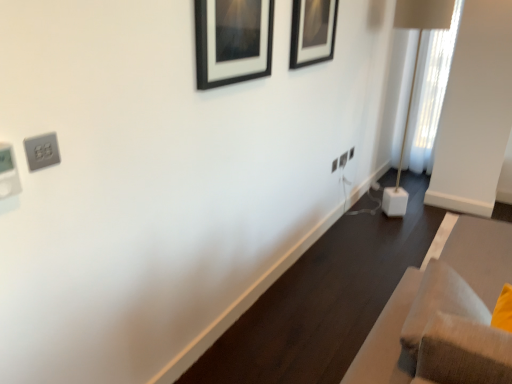
Question: Considering the positions of white cube base at right and white plastic electric outlet at center-right, which is the first electric outlet from right to left, in the image, is white cube base at right taller or shorter than white plastic electric outlet at center-right, which is the first electric outlet from right to left,?

Choices:
 (A) tall
 (B) short

Answer: (A)

Question: Do you think white cube base at right is within white plastic electric outlet at center-right, the first electric outlet positioned from the back, or outside of it?

Choices:
 (A) inside
 (B) outside

Answer: (B)

Question: Considering the real-world distances, which object is farthest from the white plastic electric outlet at center-right, positioned as the 3th electric outlet in left-to-right order?

Choices:
 (A) velvet beige sofa at lower right
 (B) white plastic electric outlet at center-right, marked as the second electric outlet in a right-to-left arrangement
 (C) black matte picture frame at upper center, marked as the 1th picture frame in a left-to-right arrangement
 (D) satin silver outlet at upper left, the first electric outlet ordered from the bottom
 (E) black matte picture frame at upper center, placed as the first picture frame when sorted from right to left

Answer: (D)

Question: Estimate the real-world distances between objects in this image. Which object is closer to the black matte picture frame at upper center, acting as the second picture frame starting from the front?

Choices:
 (A) white sheer curtain at right
 (B) black matte picture frame at upper center, which appears as the 2th picture frame when viewed from the back
 (C) white plastic electric outlet at center-right, which is the first electric outlet from right to left
 (D) velvet beige sofa at lower right
 (E) white plastic electric outlet at center-right, placed as the second electric outlet when sorted from left to right

Answer: (B)